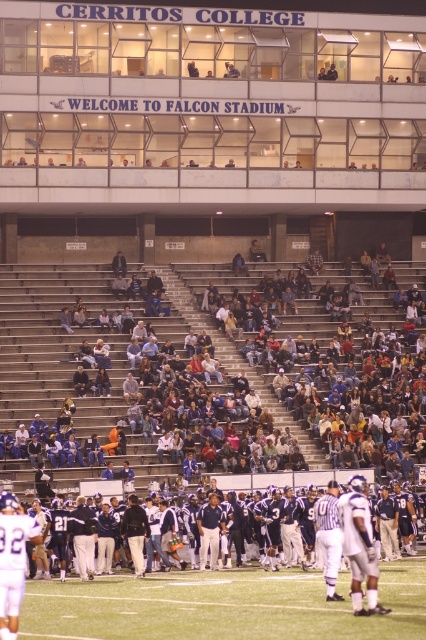
Does dark blue uniform at center lie in front of green turf football field at center?

Yes, dark blue uniform at center is closer to the viewer.

Is dark blue uniform at center shorter than green turf football field at center?

Indeed, dark blue uniform at center has a lesser height compared to green turf football field at center.

At what (x,y) coordinates should I click in order to perform the action: click on dark blue uniform at center. Please return your answer as a coordinate pair (x, y). The width and height of the screenshot is (426, 640). Looking at the image, I should click on (221, 605).

I want to click on dark blue uniform at center, so click(x=221, y=605).